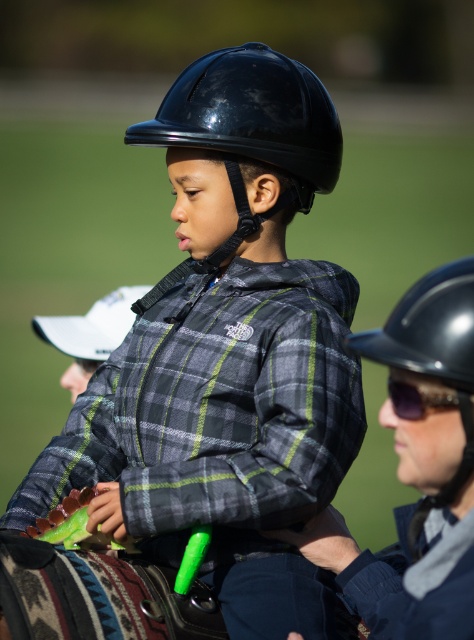
Is black glossy helmet at center to the left of black hard helmet at center from the viewer's perspective?

Correct, you'll find black glossy helmet at center to the left of black hard helmet at center.

This screenshot has width=474, height=640. Describe the element at coordinates (252, 115) in the screenshot. I see `black glossy helmet at center` at that location.

Locate an element on the screen. The height and width of the screenshot is (640, 474). black glossy helmet at center is located at coordinates (252, 115).

Who is more distant from viewer, (449, 300) or (392, 406)?

Positioned behind is point (392, 406).

The image size is (474, 640). What do you see at coordinates (428, 326) in the screenshot? I see `black hard helmet at center` at bounding box center [428, 326].

At what (x,y) coordinates should I click in order to perform the action: click on black hard helmet at center. Please return your answer as a coordinate pair (x, y). This screenshot has width=474, height=640. Looking at the image, I should click on (428, 326).

Does point (271, 180) lie in front of point (313, 156)?

No.

This screenshot has height=640, width=474. I want to click on matte black helmet at center, so click(227, 353).

At what (x,y) coordinates should I click in order to perform the action: click on matte black helmet at center. Please return your answer as a coordinate pair (x, y). The width and height of the screenshot is (474, 640). Looking at the image, I should click on (227, 353).